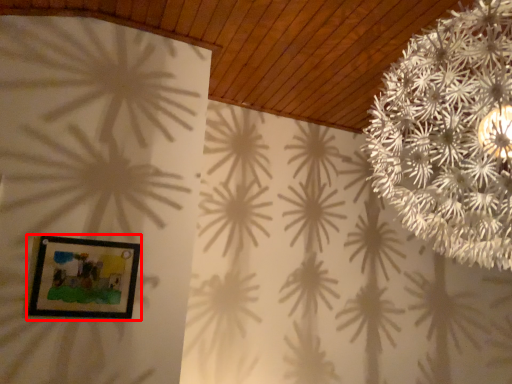
Question: From the image's perspective, where is picture frame (annotated by the red box) located relative to flower?

Choices:
 (A) above
 (B) below

Answer: (B)